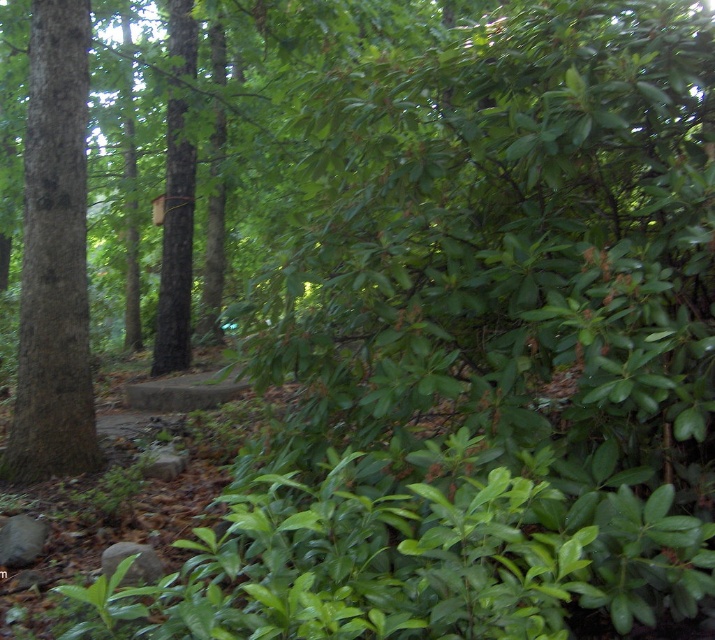
You are a bird looking for a nesting spot. You see a smooth brown tree trunk at left and a brown wood birdhouse at center. Which one is taller?

The brown wood birdhouse at center is taller than the smooth brown tree trunk at left.

You are a bird looking for a place to nest. You see a smooth brown tree trunk at left and a brown wood birdhouse at center. Which location is closer to the ground?

The smooth brown tree trunk at left is positioned under the brown wood birdhouse at center, so the smooth brown tree trunk at left is closer to the ground.